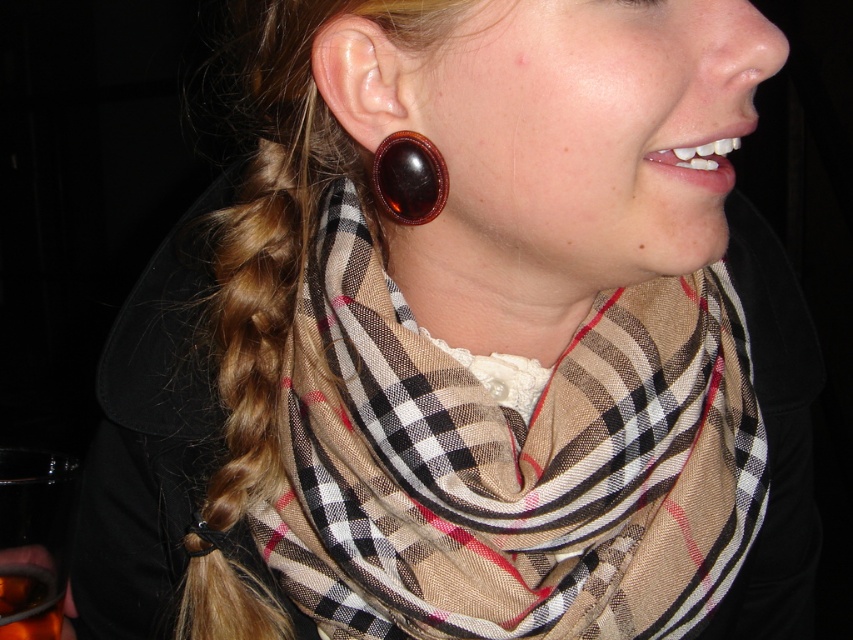
You are a fashion designer observing the image and need to determine the spatial relationship between the plaid fabric scarf at center and the translucent amber liquid at lower left. Which object is wider?

The plaid fabric scarf at center is wider than the translucent amber liquid at lower left because its width surpasses the other object.

You are a fashion designer observing the image. You need to decide which item takes up more space visually in the composition. Which object has a bigger size between the plaid fabric scarf at center and the translucent amber liquid at lower left?

The plaid fabric scarf at center has a larger size compared to the translucent amber liquid at lower left, so the plaid fabric scarf at center takes up more space visually in the composition.

Based on the scene description, where is the shiny brown earring at ear located in the image? Please provide the coordinates as a point in the format of a tuple with two decimal numbers between 0 and 1, where 0 represents the bottom left corner and 1 represents the top right corner of the image.

The shiny brown earring at ear is located at point coordinates of (409, 177).